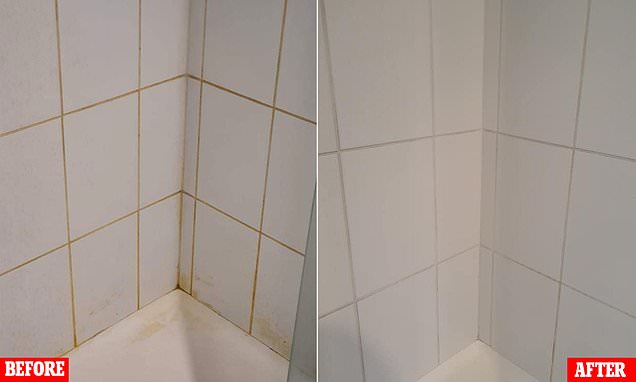
Find the location of a particular element. This screenshot has height=382, width=636. discoloured grout is located at coordinates (72, 310).